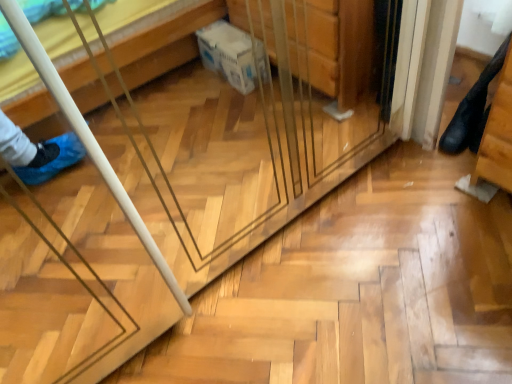
At what (x,y) coordinates should I click in order to perform the action: click on black leather drawer at right. Please return your answer as a coordinate pair (x, y). Looking at the image, I should click on (498, 135).

In order to face black leather drawer at right, should I rotate leftwards or rightwards?

Rotate right and turn 29.805 degrees.

What do you see at coordinates (498, 135) in the screenshot? The width and height of the screenshot is (512, 384). I see `black leather drawer at right` at bounding box center [498, 135].

Locate an element on the screen. The height and width of the screenshot is (384, 512). black leather drawer at right is located at coordinates [x=498, y=135].